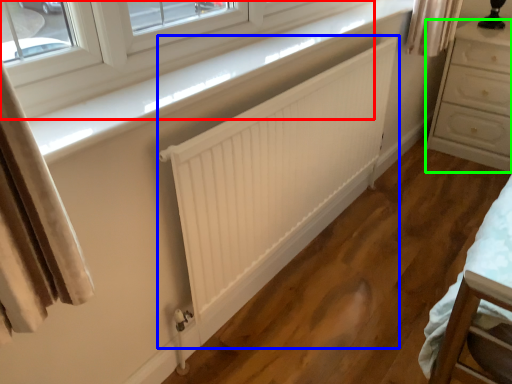
Question: Which object is positioned farthest from window (highlighted by a red box)? Select from radiator (highlighted by a blue box) and chest of drawers (highlighted by a green box).

Choices:
 (A) radiator
 (B) chest of drawers

Answer: (B)